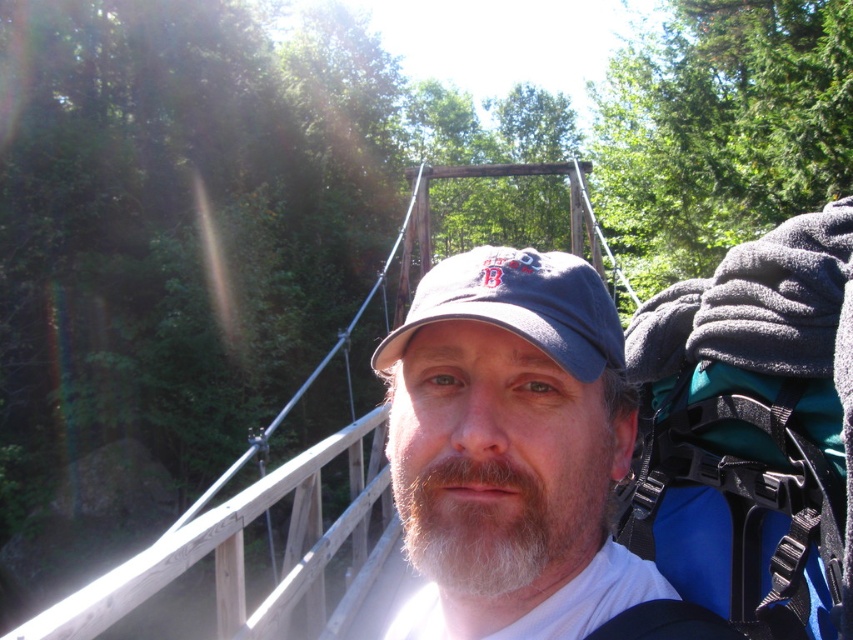
At what (x,y) coordinates should I click in order to perform the action: click on gray fabric cap at center. Please return your answer as a coordinate pair (x, y). This screenshot has height=640, width=853. Looking at the image, I should click on (517, 456).

Does point (589, 557) lie behind point (436, 506)?

Yes, point (589, 557) is farther from viewer.

Which is in front, point (444, 630) or point (532, 460)?

Positioned in front is point (532, 460).

Locate an element on the screen. This screenshot has height=640, width=853. gray fabric cap at center is located at coordinates (517, 456).

Can you confirm if gray fabric cap at center is taller than teal fabric backpack at upper right?

Yes.

In the scene shown: Is the position of gray fabric cap at center more distant than that of teal fabric backpack at upper right?

No.

Between point (450, 461) and point (817, 625), which one is positioned in front?

Point (450, 461) is in front.

Where is `gray fabric cap at center`? gray fabric cap at center is located at coordinates (517, 456).

Does teal fabric backpack at upper right appear on the right side of white fuzzy beard at center?

Correct, you'll find teal fabric backpack at upper right to the right of white fuzzy beard at center.

Who is more distant from viewer, (833, 529) or (538, 579)?

The point (833, 529) is behind.

Locate an element on the screen. teal fabric backpack at upper right is located at coordinates (751, 432).